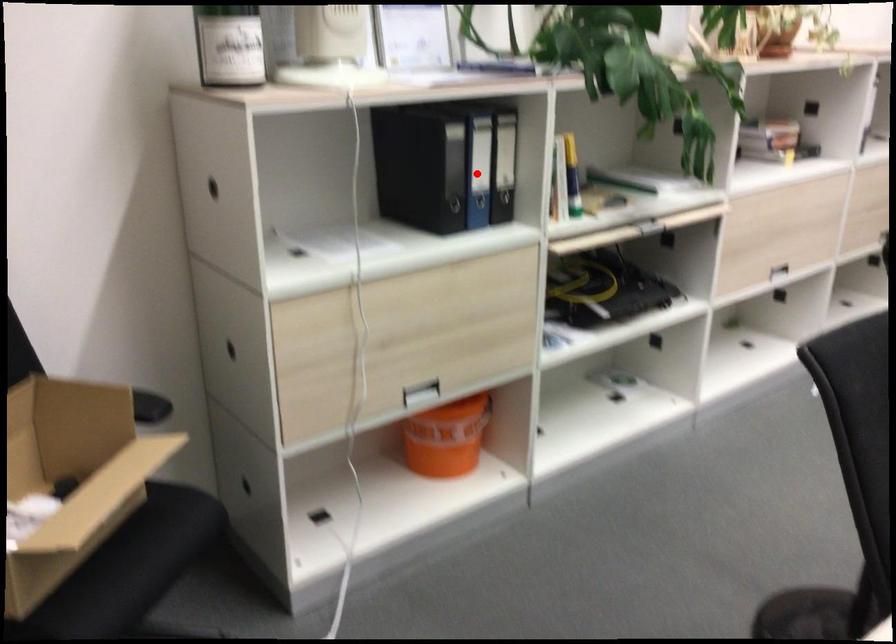
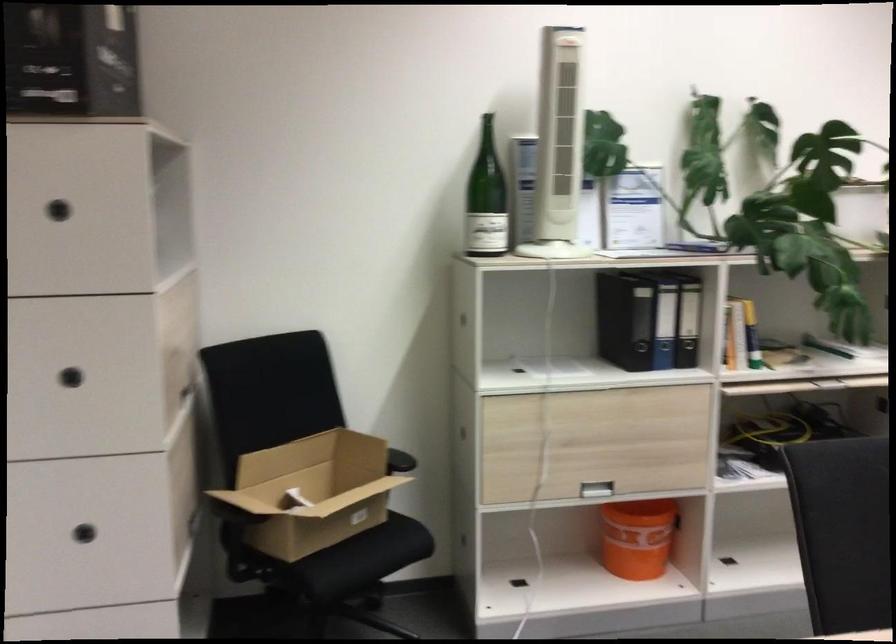
Question: I am providing you with two images of the same scene from different viewpoints. A red point is shown in image1. For the corresponding object point in image2, is it positioned nearer or farther from the camera?

Choices:
 (A) Nearer
 (B) Farther

Answer: (B)